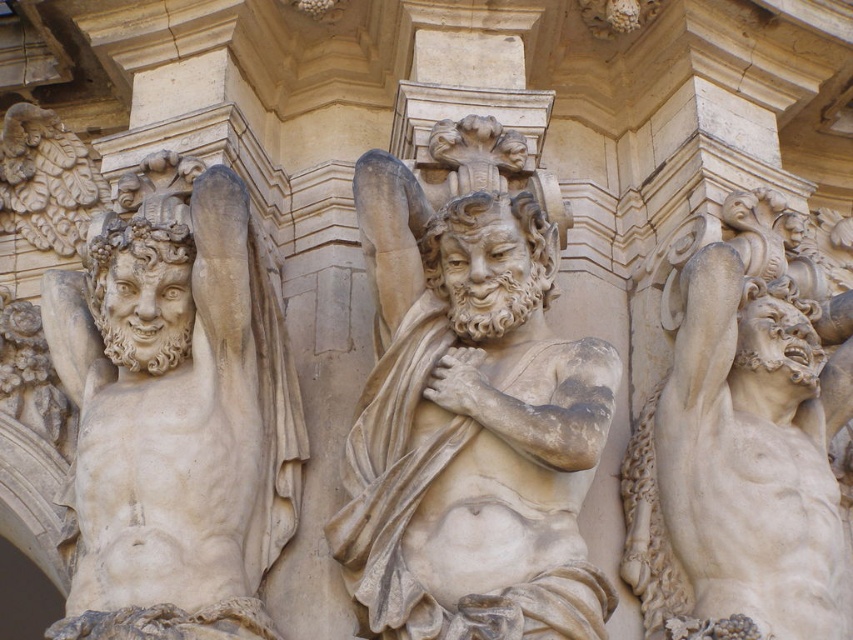
Question: Which point is farther from the camera taking this photo?

Choices:
 (A) tap(587, 348)
 (B) tap(100, 554)

Answer: (A)

Question: Does beige stone figure at center appear on the left side of matte stone figure at left?

Choices:
 (A) no
 (B) yes

Answer: (A)

Question: Can you confirm if beige stone figure at center is bigger than matte stone figure at left?

Choices:
 (A) no
 (B) yes

Answer: (A)

Question: Which of the following is the closest to the observer?

Choices:
 (A) (277, 484)
 (B) (332, 544)

Answer: (B)

Question: Is beige stone figure at center above matte stone figure at left?

Choices:
 (A) no
 (B) yes

Answer: (B)